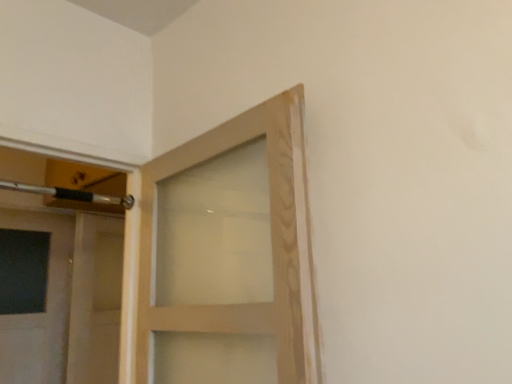
Question: Do you think matte wood door at center is within metallic silver door handle at upper left, or outside of it?

Choices:
 (A) outside
 (B) inside

Answer: (A)

Question: Looking at their shapes, would you say matte wood door at center is wider or thinner than metallic silver door handle at upper left?

Choices:
 (A) thin
 (B) wide

Answer: (B)

Question: Considering the positions of matte wood door at center and metallic silver door handle at upper left in the image, is matte wood door at center bigger or smaller than metallic silver door handle at upper left?

Choices:
 (A) small
 (B) big

Answer: (B)

Question: In the image, is metallic silver door handle at upper left positioned in front of or behind matte wood door at center?

Choices:
 (A) behind
 (B) front

Answer: (B)

Question: Is metallic silver door handle at upper left taller or shorter than matte wood door at center?

Choices:
 (A) short
 (B) tall

Answer: (A)

Question: Considering the positions of point (65, 192) and point (73, 301), is point (65, 192) closer or farther from the camera than point (73, 301)?

Choices:
 (A) closer
 (B) farther

Answer: (A)

Question: From a real-world perspective, is metallic silver door handle at upper left above or below matte wood door at center?

Choices:
 (A) below
 (B) above

Answer: (B)